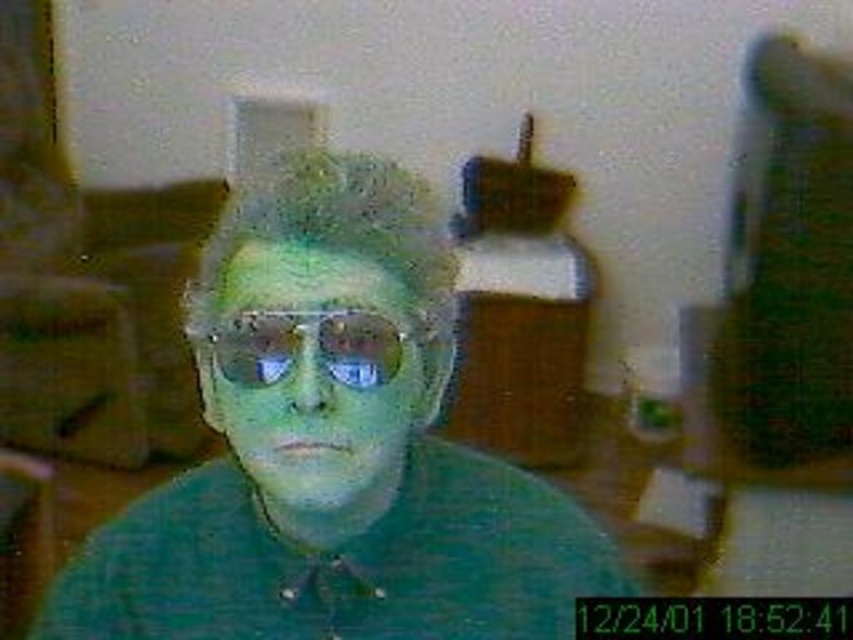
Question: Based on their relative distances, which object is nearer to the green matte face at center?

Choices:
 (A) metallic reflective sunglasses at center
 (B) green matte shirt at center

Answer: (A)

Question: Can you confirm if green matte shirt at center is positioned to the left of metallic reflective sunglasses at center?

Choices:
 (A) yes
 (B) no

Answer: (B)

Question: Can you confirm if green matte shirt at center is smaller than metallic reflective sunglasses at center?

Choices:
 (A) yes
 (B) no

Answer: (B)

Question: Which of the following is the farthest from the observer?

Choices:
 (A) (221, 356)
 (B) (460, 458)
 (C) (338, 502)

Answer: (B)

Question: Which object is the closest to the metallic reflective sunglasses at center?

Choices:
 (A) green matte face at center
 (B) green matte shirt at center

Answer: (A)

Question: Can you confirm if green matte face at center is positioned above metallic reflective sunglasses at center?

Choices:
 (A) no
 (B) yes

Answer: (A)